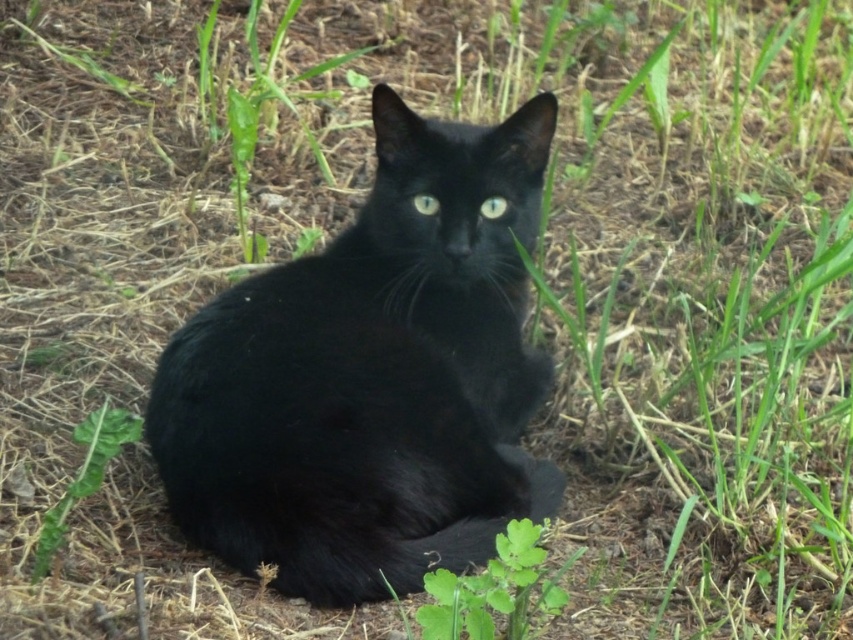
Question: Does shiny black cat at center have a larger size compared to green leafy plant at lower center?

Choices:
 (A) no
 (B) yes

Answer: (B)

Question: Which object is the closest to the green leafy weed at lower left?

Choices:
 (A) glossy white eye at center
 (B) shiny green eye at center
 (C) shiny black cat at center
 (D) green leafy plant at lower center

Answer: (C)

Question: Can you confirm if green leafy weed at lower left is positioned below shiny green eye at center?

Choices:
 (A) no
 (B) yes

Answer: (B)

Question: Is green leafy plant at lower center bigger than glossy white eye at center?

Choices:
 (A) no
 (B) yes

Answer: (B)

Question: Which of these objects is positioned closest to the green leafy plant at lower center?

Choices:
 (A) shiny green eye at center
 (B) glossy white eye at center
 (C) green leafy weed at lower left
 (D) shiny black cat at center

Answer: (D)

Question: Estimate the real-world distances between objects in this image. Which object is closer to the green leafy plant at lower center?

Choices:
 (A) shiny black cat at center
 (B) green leafy weed at lower left
 (C) glossy white eye at center
 (D) shiny green eye at center

Answer: (A)